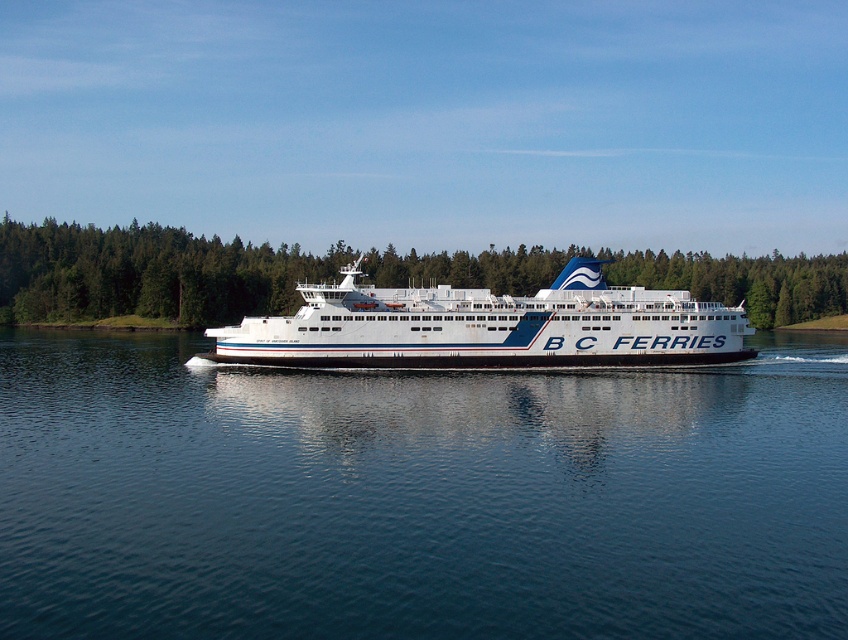
Between blue water at center and green leafy forest at center, which one appears on the right side from the viewer's perspective?

From the viewer's perspective, blue water at center appears more on the right side.

Who is shorter, blue water at center or green leafy forest at center?

blue water at center

At what (x,y) coordinates should I click in order to perform the action: click on blue water at center. Please return your answer as a coordinate pair (x, y). Looking at the image, I should click on (417, 497).

Describe the element at coordinates (417, 497) in the screenshot. I see `blue water at center` at that location.

Who is more forward, [24,554] or [428,332]?

Positioned in front is point [24,554].

Locate an element on the screen. blue water at center is located at coordinates (417, 497).

Measure the distance between green leafy forest at center and white glossy ferry at center.

The distance of green leafy forest at center from white glossy ferry at center is 83.36 meters.

Between point (155, 307) and point (291, 339), which one is positioned behind?

The point (155, 307) is behind.

Is point (734, 275) farther from viewer compared to point (605, 364)?

That is True.

The image size is (848, 640). Identify the location of green leafy forest at center. (148, 273).